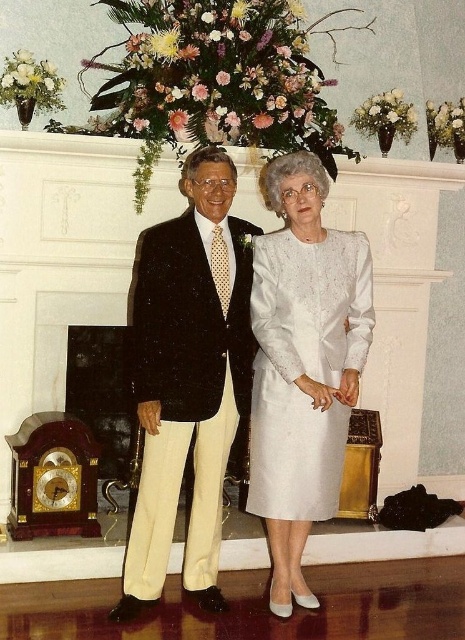
In the scene shown: Does matte black suit at center appear on the right side of white satin dress at center?

Incorrect, matte black suit at center is not on the right side of white satin dress at center.

Measure the distance between point (192,368) and camera.

A distance of 2.94 meters exists between point (192,368) and camera.

The height and width of the screenshot is (640, 465). Find the location of `matte black suit at center`. matte black suit at center is located at coordinates (188, 378).